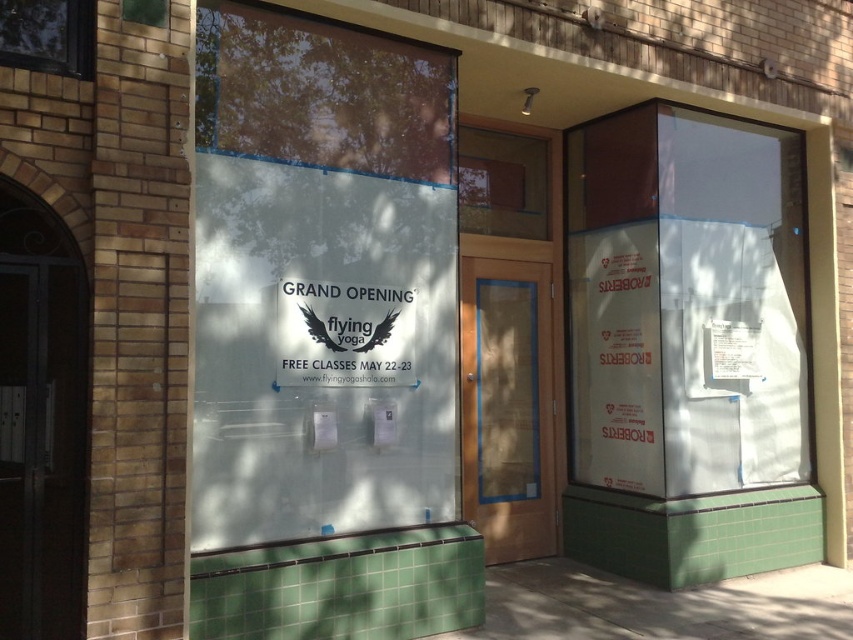
You are a customer looking at the storefront and want to read both the transparent glass sign at center and the white paper sign at center. Which one do you need to look up higher to see?

The transparent glass sign at center has a greater height compared to the white paper sign at center, so you need to look up higher to see the transparent glass sign at center.

You are a delivery person who needs to hand a package to the Flying Yoga studio. The package must be placed on the ground near the entrance. However, there is a dark wood door at left and a white paper sign at center. Which object should you place the package next to so it is clearly visible to the staff?

The dark wood door at left is much taller than the white paper sign at center, so placing the package next to the dark wood door at left will make it more visible to the staff.

Looking at this image, you are a customer looking at the storefront. The transparent glass sign at center and the white paper sign at center both have important information. Which one is wider?

The transparent glass sign at center is wider than the white paper sign at center according to the description provided.